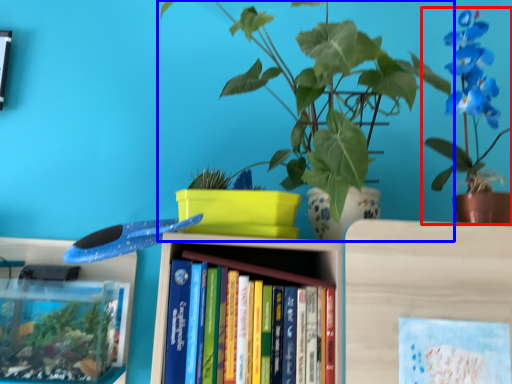
Question: Which point is further to the camera, houseplant (highlighted by a red box) or houseplant (highlighted by a blue box)?

Choices:
 (A) houseplant
 (B) houseplant

Answer: (A)